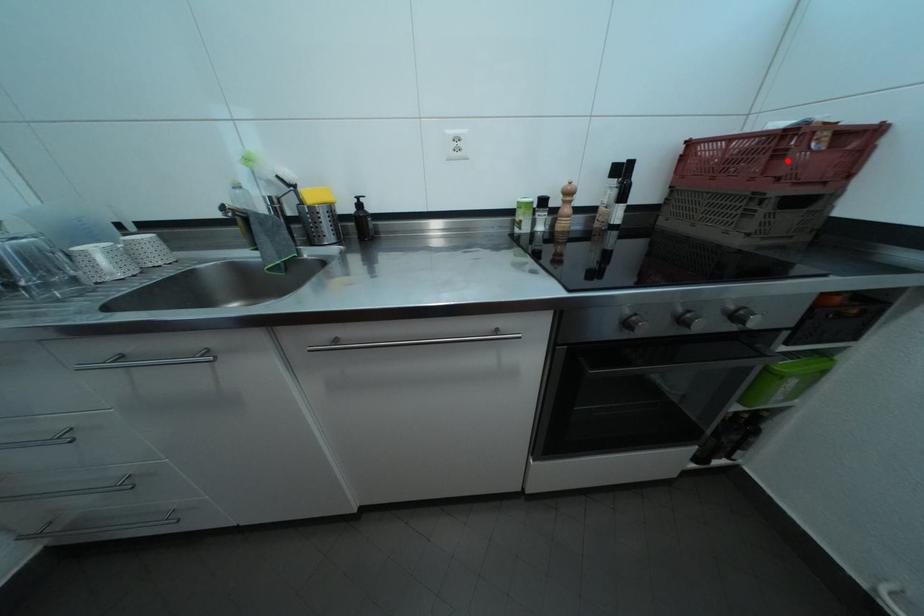
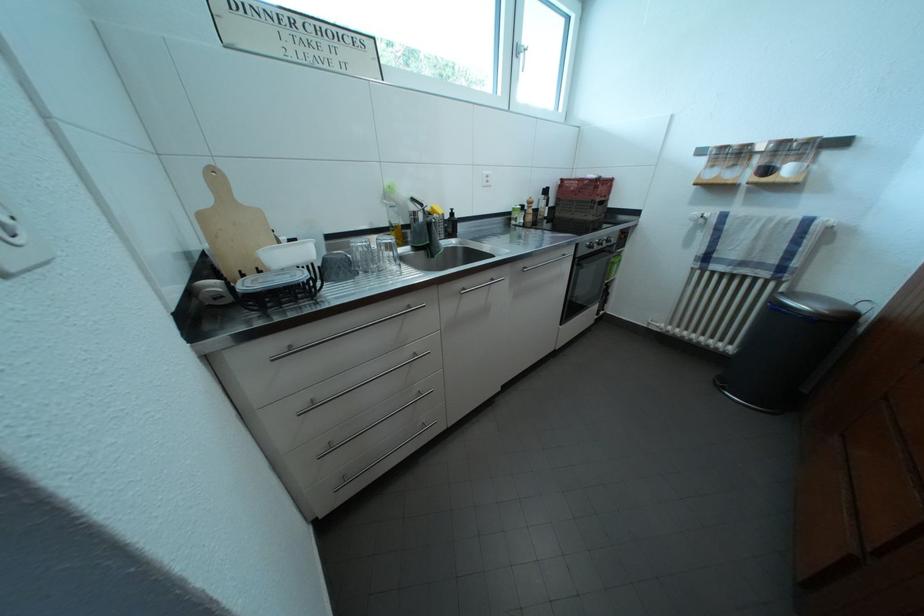
Question: I am providing you with two images of the same scene from different viewpoints. A red point is marked on the first image. Can you still see the location of the red point in image 2?

Choices:
 (A) Yes
 (B) No

Answer: (A)